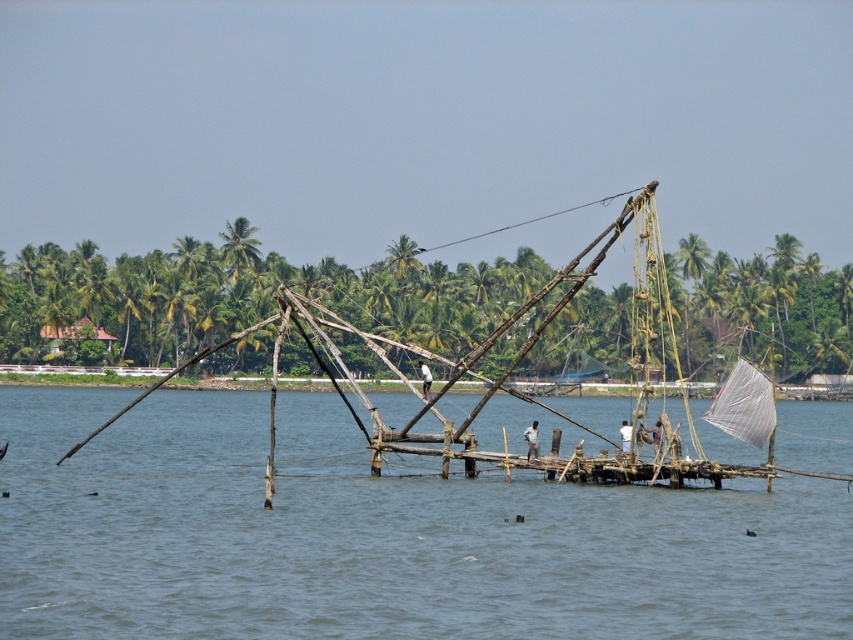
You are standing on the wooden boat at center and want to reach the light brown wooden pole at center. In which direction should you move relative to the boat?

You should move to the right to reach the light brown wooden pole at center since the wooden boat at center is to the left of it.

Consider the image. You are standing on the shore and see the wooden boat at center. If you want to throw a lifebuoy to someone on the boat, and the lifebuoy has a throwing range of 50 meters, will you be able to reach them?

The wooden boat at center is 52.75 meters away from the camera. Since the lifebuoy has a maximum range of 50 meters, you won

From the picture: You are a tourist standing on the dock and want to take a photo of the transparent water at center and the light brown wooden pole at center. Which object will appear wider in the photo?

The transparent water at center will appear wider in the photo because its width is larger than the light brown wooden pole at center.